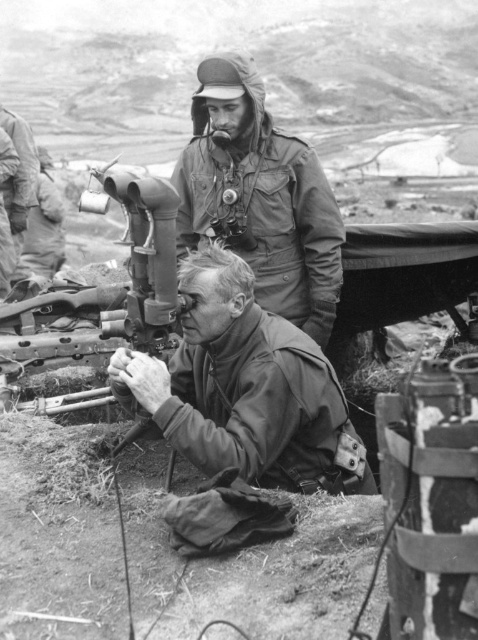
Question: Which of the following is the farthest from the observer?

Choices:
 (A) (330, 259)
 (B) (43, 166)

Answer: (B)

Question: Is matte green uniform at center closer to camera compared to camouflage fabric jacket at left?

Choices:
 (A) yes
 (B) no

Answer: (A)

Question: Does matte green uniform at upper center appear on the right side of camouflage fabric jacket at left?

Choices:
 (A) yes
 (B) no

Answer: (A)

Question: Estimate the real-world distances between objects in this image. Which object is farther from the matte green uniform at center?

Choices:
 (A) matte black rifle at left
 (B) camouflage fabric jacket at left
 (C) matte green uniform at upper center

Answer: (B)

Question: Does matte green uniform at center have a greater width compared to matte green uniform at upper center?

Choices:
 (A) no
 (B) yes

Answer: (B)

Question: Considering the real-world distances, which object is closest to the matte green uniform at upper center?

Choices:
 (A) matte black rifle at left
 (B) camouflage fabric jacket at left

Answer: (A)